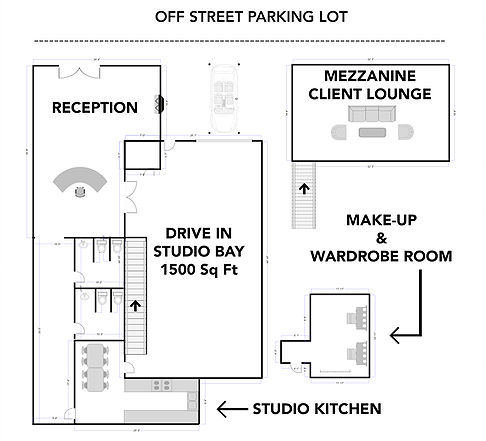
The image size is (486, 441). What are the coordinates of `bathroom` in the screenshot? It's located at (87, 255), (87, 320).